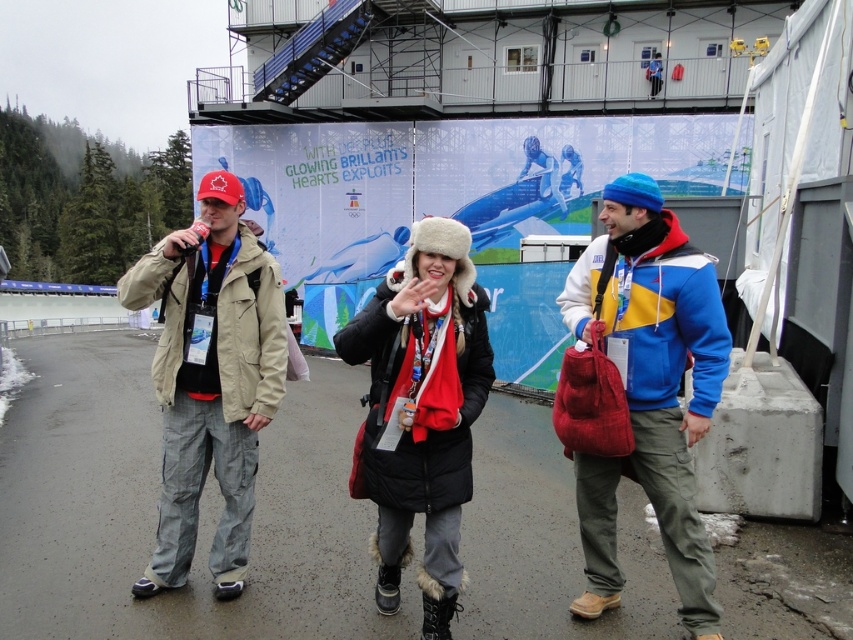
Question: Does blue fleece jacket at center have a larger size compared to matte khaki jacket at center?

Choices:
 (A) yes
 (B) no

Answer: (B)

Question: Which point is farther from the camera taking this photo?

Choices:
 (A) (189, 269)
 (B) (612, 464)

Answer: (A)

Question: Does blue fleece jacket at center have a larger size compared to black fur-lined coat at center?

Choices:
 (A) no
 (B) yes

Answer: (B)

Question: Is blue fleece jacket at center smaller than matte khaki jacket at center?

Choices:
 (A) yes
 (B) no

Answer: (A)

Question: Which object is closer to the camera taking this photo?

Choices:
 (A) blue fleece jacket at center
 (B) matte khaki jacket at center

Answer: (A)

Question: Based on their relative distances, which object is farther from the matte khaki jacket at center?

Choices:
 (A) blue fleece jacket at center
 (B) black fur-lined coat at center

Answer: (A)